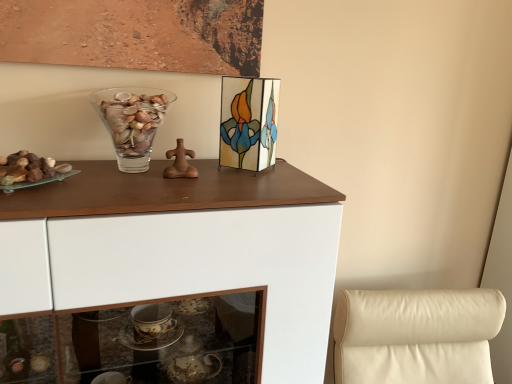
Question: Does translucent glass rocks at left have a lesser width compared to transparent glass vase at upper center?

Choices:
 (A) no
 (B) yes

Answer: (A)

Question: From the image's perspective, is translucent glass rocks at left beneath transparent glass vase at upper center?

Choices:
 (A) yes
 (B) no

Answer: (A)

Question: Is translucent glass rocks at left bigger than transparent glass vase at upper center?

Choices:
 (A) no
 (B) yes

Answer: (A)

Question: Would you say translucent glass rocks at left contains transparent glass vase at upper center?

Choices:
 (A) no
 (B) yes

Answer: (A)

Question: Does translucent glass rocks at left have a lesser height compared to transparent glass vase at upper center?

Choices:
 (A) yes
 (B) no

Answer: (A)

Question: Is translucent glass rocks at left to the left or to the right of transparent glass vase at upper center in the image?

Choices:
 (A) right
 (B) left

Answer: (B)

Question: Is point (29, 170) closer or farther from the camera than point (147, 112)?

Choices:
 (A) farther
 (B) closer

Answer: (B)

Question: Is translucent glass rocks at left wider or thinner than transparent glass vase at upper center?

Choices:
 (A) wide
 (B) thin

Answer: (A)

Question: Looking at the image, does translucent glass rocks at left seem bigger or smaller compared to transparent glass vase at upper center?

Choices:
 (A) small
 (B) big

Answer: (A)

Question: From a real-world perspective, is translucent glass rocks at left positioned above or below stained glass picture frame at upper center?

Choices:
 (A) below
 (B) above

Answer: (A)

Question: Visually, is translucent glass rocks at left positioned to the left or to the right of stained glass picture frame at upper center?

Choices:
 (A) left
 (B) right

Answer: (A)

Question: Is translucent glass rocks at left situated inside stained glass picture frame at upper center or outside?

Choices:
 (A) inside
 (B) outside

Answer: (B)

Question: Considering the positions of translucent glass rocks at left and stained glass picture frame at upper center in the image, is translucent glass rocks at left bigger or smaller than stained glass picture frame at upper center?

Choices:
 (A) small
 (B) big

Answer: (A)

Question: Choose the correct answer: Is transparent glass vase at upper center inside stained glass picture frame at upper center or outside it?

Choices:
 (A) inside
 (B) outside

Answer: (B)

Question: Does point (152, 99) appear closer or farther from the camera than point (243, 142)?

Choices:
 (A) farther
 (B) closer

Answer: (B)